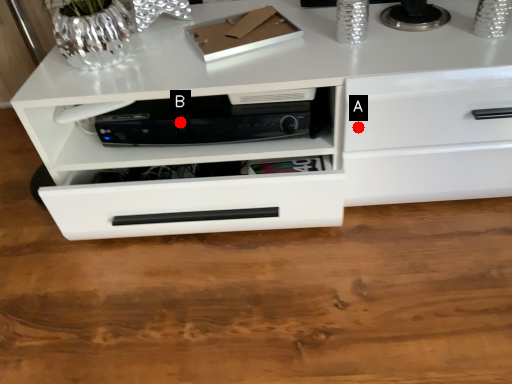
Question: Two points are circled on the image, labeled by A and B beside each circle. Which point is closer to the camera?

Choices:
 (A) A is closer
 (B) B is closer

Answer: (A)